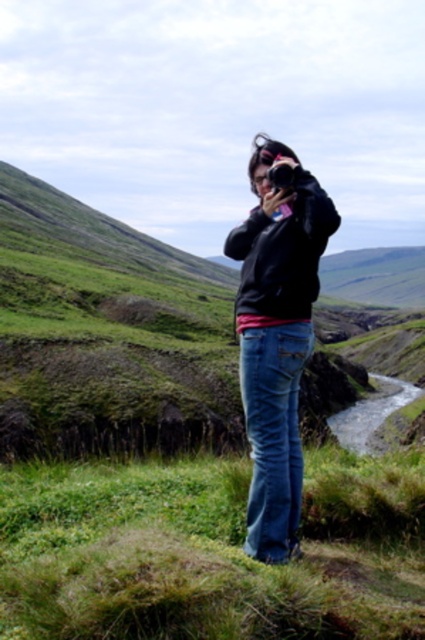
Does green grassy at center have a lesser width compared to black plastic camera at center?

No, green grassy at center is not thinner than black plastic camera at center.

How far apart are green grassy at center and black plastic camera at center?

5.91 meters

Measure the distance between green grassy at center and camera.

20.41 feet

Locate an element on the screen. green grassy at center is located at coordinates (209, 552).

Can you confirm if green grassy at center is positioned to the left of matte black hoodie at center?

Indeed, green grassy at center is positioned on the left side of matte black hoodie at center.

How much distance is there between green grassy at center and matte black hoodie at center?

green grassy at center is 2.25 meters away from matte black hoodie at center.

The height and width of the screenshot is (640, 425). What do you see at coordinates (209, 552) in the screenshot? I see `green grassy at center` at bounding box center [209, 552].

Where is `green grassy at center`? green grassy at center is located at coordinates (209, 552).

Between point (280, 342) and point (297, 170), which one is positioned in front?

Positioned in front is point (280, 342).

Which is below, matte black hoodie at center or black plastic camera at center?

matte black hoodie at center

Between point (289, 156) and point (277, 170), which one is positioned in front?

Positioned in front is point (277, 170).

You are a GUI agent. You are given a task and a screenshot of the screen. Output one action in this format:
    pyautogui.click(x=<x>, y=<y>)
    Task: Click on the matte black hoodie at center
    The height and width of the screenshot is (640, 425).
    Given the screenshot: What is the action you would take?
    pyautogui.click(x=277, y=339)